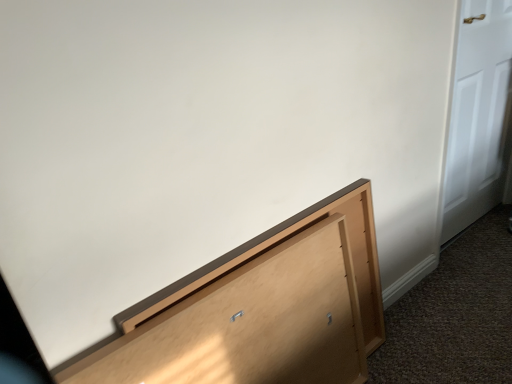
Question: Is white glossy door at right behind light brown wood cabinet at lower right?

Choices:
 (A) no
 (B) yes

Answer: (B)

Question: Are white glossy door at right and light brown wood cabinet at lower right making contact?

Choices:
 (A) no
 (B) yes

Answer: (A)

Question: Does white glossy door at right come in front of light brown wood cabinet at lower right?

Choices:
 (A) yes
 (B) no

Answer: (B)

Question: From a real-world perspective, is white glossy door at right below light brown wood cabinet at lower right?

Choices:
 (A) no
 (B) yes

Answer: (A)

Question: Does white glossy door at right appear on the left side of light brown wood cabinet at lower right?

Choices:
 (A) yes
 (B) no

Answer: (B)

Question: Does white glossy door at right have a greater height compared to light brown wood cabinet at lower right?

Choices:
 (A) yes
 (B) no

Answer: (A)

Question: Can you confirm if light brown wood cabinet at lower right is wider than white glossy door at right?

Choices:
 (A) no
 (B) yes

Answer: (A)

Question: Is light brown wood cabinet at lower right bigger than white glossy door at right?

Choices:
 (A) no
 (B) yes

Answer: (A)

Question: Is light brown wood cabinet at lower right positioned with its back to white glossy door at right?

Choices:
 (A) yes
 (B) no

Answer: (B)

Question: Can you see light brown wood cabinet at lower right touching white glossy door at right?

Choices:
 (A) yes
 (B) no

Answer: (B)

Question: From a real-world perspective, is light brown wood cabinet at lower right positioned under white glossy door at right based on gravity?

Choices:
 (A) yes
 (B) no

Answer: (A)

Question: From the image's perspective, is light brown wood cabinet at lower right beneath white glossy door at right?

Choices:
 (A) no
 (B) yes

Answer: (B)

Question: In terms of width, does white glossy door at right look wider or thinner when compared to light brown wood cabinet at lower right?

Choices:
 (A) thin
 (B) wide

Answer: (B)